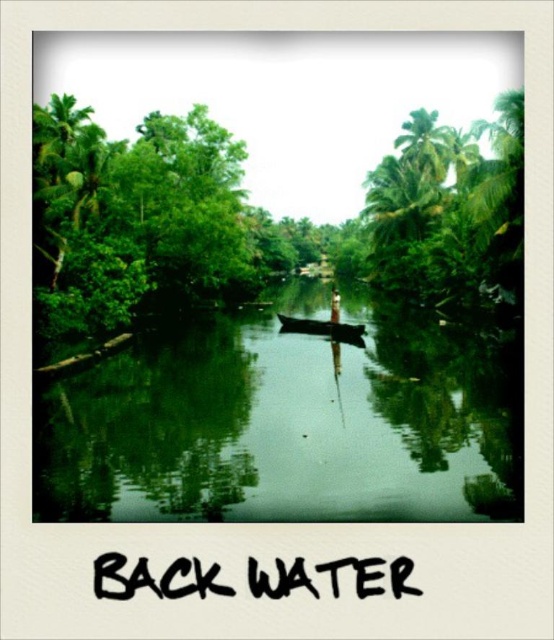
Question: Is green leafy tree at left closer to the viewer compared to black wood canoe at center?

Choices:
 (A) yes
 (B) no

Answer: (A)

Question: Does green leafy tree at left come behind green leafy tree at upper right?

Choices:
 (A) yes
 (B) no

Answer: (B)

Question: Which object is positioned farthest from the green leafy tree at upper right?

Choices:
 (A) green leafy tree at left
 (B) green smooth water at center

Answer: (B)

Question: Is green leafy tree at left wider than green leafy tree at upper right?

Choices:
 (A) yes
 (B) no

Answer: (A)

Question: Which object appears closest to the camera in this image?

Choices:
 (A) green leafy tree at left
 (B) green smooth water at center

Answer: (B)

Question: Which point is closer to the camera?

Choices:
 (A) (381, 250)
 (B) (79, 113)
 (C) (330, 330)
 (D) (327, 486)

Answer: (D)